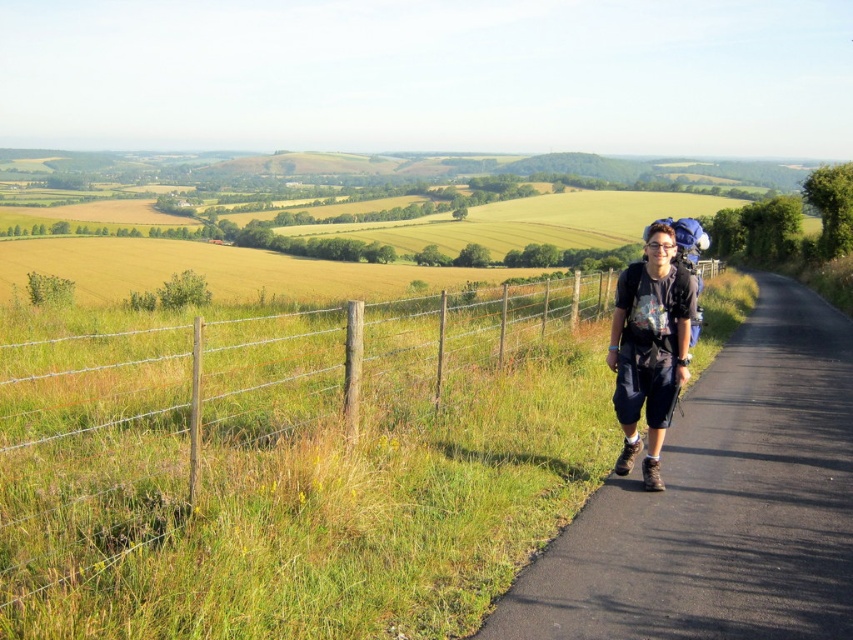
Does black asphalt road at center-right appear on the left side of dark blue fabric backpack at right?

No, black asphalt road at center-right is not to the left of dark blue fabric backpack at right.

Identify the location of black asphalt road at center-right. (720, 502).

This screenshot has width=853, height=640. What are the coordinates of `black asphalt road at center-right` in the screenshot? It's located at (720, 502).

Is wooden post wire fence at left taller than black asphalt road at center-right?

Yes, wooden post wire fence at left is taller than black asphalt road at center-right.

Which is below, wooden post wire fence at left or black asphalt road at center-right?

Positioned lower is black asphalt road at center-right.

Does point (579, 333) come behind point (834, 339)?

No, (579, 333) is closer to viewer.

Find the location of a particular element. wooden post wire fence at left is located at coordinates (292, 465).

This screenshot has height=640, width=853. Describe the element at coordinates (292, 465) in the screenshot. I see `wooden post wire fence at left` at that location.

From the picture: Does wooden post wire fence at left have a larger size compared to dark blue fabric backpack at right?

Yes, wooden post wire fence at left is bigger than dark blue fabric backpack at right.

You are a GUI agent. You are given a task and a screenshot of the screen. Output one action in this format:
    pyautogui.click(x=<x>, y=<y>)
    Task: Click on the wooden post wire fence at left
    
    Given the screenshot: What is the action you would take?
    pyautogui.click(x=292, y=465)

Image resolution: width=853 pixels, height=640 pixels. Find the location of `wooden post wire fence at left`. wooden post wire fence at left is located at coordinates (292, 465).